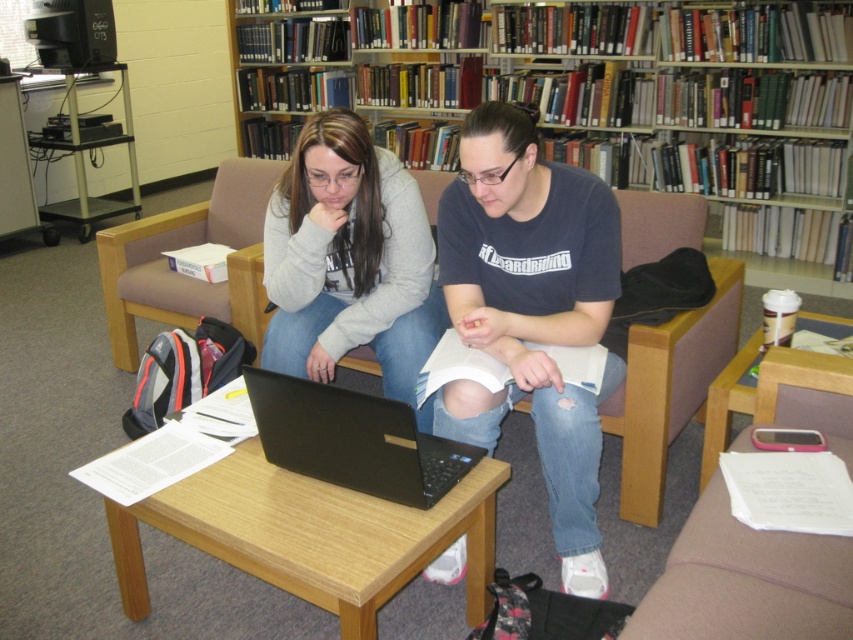
Who is positioned more to the right, wooden bookcase at upper center or beige fabric armchair at left?

From the viewer's perspective, wooden bookcase at upper center appears more on the right side.

Who is taller, wooden bookcase at upper center or beige fabric armchair at left?

Standing taller between the two is wooden bookcase at upper center.

Who is more forward, (x=763, y=116) or (x=202, y=211)?

Point (x=202, y=211) is in front.

You are a GUI agent. You are given a task and a screenshot of the screen. Output one action in this format:
    pyautogui.click(x=<x>, y=<y>)
    Task: Click on the wooden bookcase at upper center
    
    Given the screenshot: What is the action you would take?
    pyautogui.click(x=715, y=131)

Which is below, matte gray sweater at center or pink fabric armchair at lower right?

pink fabric armchair at lower right is below.

Is matte gray sweater at center below pink fabric armchair at lower right?

No.

In the scene shown: Who is more distant from viewer, (291, 257) or (813, 397)?

The point (291, 257) is more distant.

At what (x,y) coordinates should I click in order to perform the action: click on matte gray sweater at center. Please return your answer as a coordinate pair (x, y). The height and width of the screenshot is (640, 853). Looking at the image, I should click on pyautogui.click(x=347, y=259).

Between point (457, 177) and point (236, 264), which one is positioned behind?

The point (236, 264) is more distant.

Between point (543, 170) and point (146, 273), which one is positioned in front?

Positioned in front is point (543, 170).

Locate an element on the screen. matte black laptop at center is located at coordinates (531, 310).